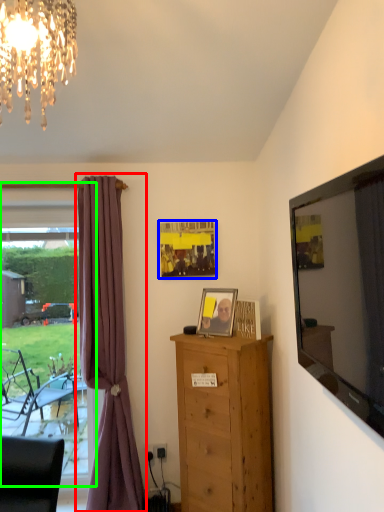
Question: Which object is the farthest from curtain (highlighted by a red box)? Choose among these: picture frame (highlighted by a blue box) or window frame (highlighted by a green box).

Choices:
 (A) picture frame
 (B) window frame

Answer: (B)